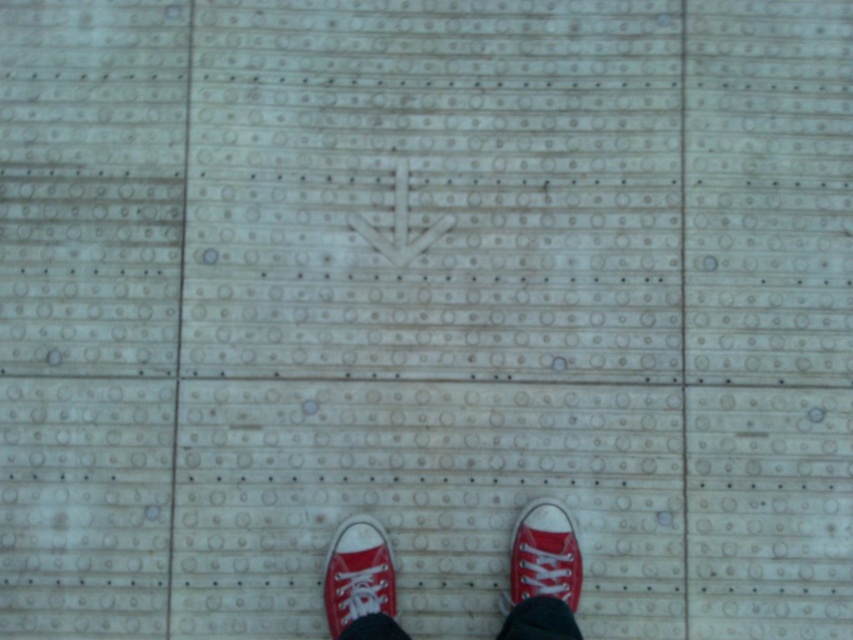
In the scene shown: Is red canvas shoes at center below matte red sneaker at center?

Yes, red canvas shoes at center is below matte red sneaker at center.

Is red canvas shoes at center to the right of matte red sneaker at center from the viewer's perspective?

Yes, red canvas shoes at center is to the right of matte red sneaker at center.

This screenshot has height=640, width=853. Identify the location of red canvas shoes at center. (543, 576).

Which is in front, point (326, 611) or point (546, 536)?

Point (546, 536) is more forward.

Which is in front, point (329, 552) or point (578, 596)?

Point (578, 596)

This screenshot has width=853, height=640. Identify the location of matte red sneaker at center. (357, 573).

This screenshot has width=853, height=640. What are the coordinates of `red canvas shoes at center` in the screenshot? It's located at (543, 576).

How far apart are red canvas shoes at center and red canvas shoe at lower center?

red canvas shoes at center and red canvas shoe at lower center are 3.04 inches apart.

This screenshot has width=853, height=640. I want to click on red canvas shoes at center, so click(x=543, y=576).